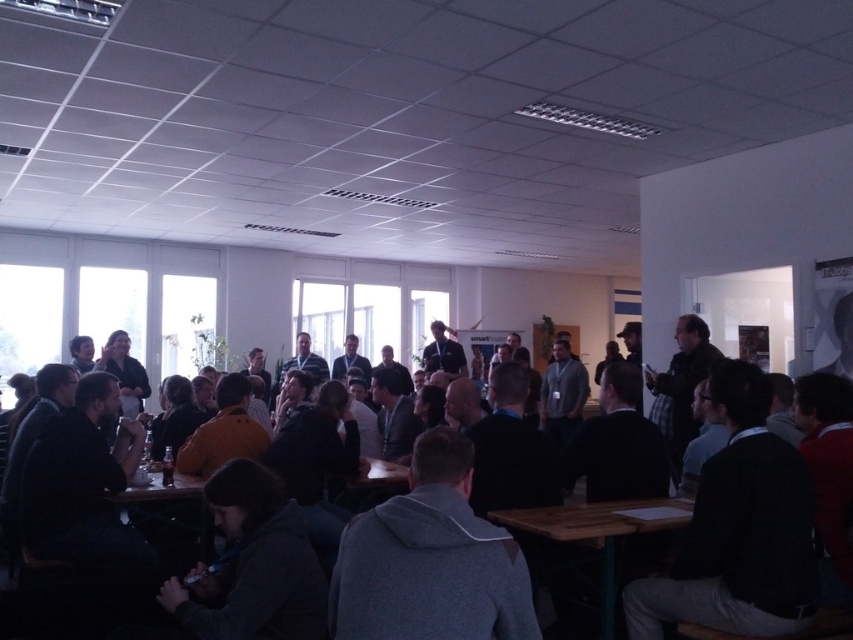
Does dark gray hoodie at center appear on the left side of wooden table at lower center?

In fact, dark gray hoodie at center is to the right of wooden table at lower center.

This screenshot has width=853, height=640. Find the location of `dark gray hoodie at center`. dark gray hoodie at center is located at coordinates (824, 440).